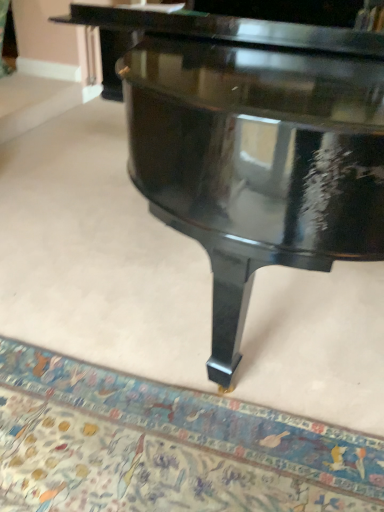
Question: In which direction should I rotate to look at carpet with intricate patterns at lower center?

Choices:
 (A) left
 (B) right

Answer: (A)

Question: Is glossy black piano at center further to camera compared to carpet with intricate patterns at lower center?

Choices:
 (A) no
 (B) yes

Answer: (A)

Question: Considering the relative sizes of glossy black piano at center and carpet with intricate patterns at lower center in the image provided, is glossy black piano at center bigger than carpet with intricate patterns at lower center?

Choices:
 (A) yes
 (B) no

Answer: (A)

Question: Can you confirm if glossy black piano at center is shorter than carpet with intricate patterns at lower center?

Choices:
 (A) yes
 (B) no

Answer: (B)

Question: From a real-world perspective, is glossy black piano at center on carpet with intricate patterns at lower center?

Choices:
 (A) yes
 (B) no

Answer: (A)

Question: From the image's perspective, is glossy black piano at center on carpet with intricate patterns at lower center?

Choices:
 (A) yes
 (B) no

Answer: (A)

Question: Is glossy black piano at center closer to camera compared to carpet with intricate patterns at lower center?

Choices:
 (A) no
 (B) yes

Answer: (B)

Question: From the image's perspective, is carpet with intricate patterns at lower center located beneath glossy black piano at center?

Choices:
 (A) yes
 (B) no

Answer: (A)

Question: Can you confirm if carpet with intricate patterns at lower center is shorter than glossy black piano at center?

Choices:
 (A) no
 (B) yes

Answer: (B)

Question: Is glossy black piano at center at the back of carpet with intricate patterns at lower center?

Choices:
 (A) yes
 (B) no

Answer: (B)

Question: Can you confirm if carpet with intricate patterns at lower center is taller than glossy black piano at center?

Choices:
 (A) yes
 (B) no

Answer: (B)

Question: Considering the relative sizes of carpet with intricate patterns at lower center and glossy black piano at center in the image provided, is carpet with intricate patterns at lower center bigger than glossy black piano at center?

Choices:
 (A) yes
 (B) no

Answer: (B)

Question: Is carpet with intricate patterns at lower center with glossy black piano at center?

Choices:
 (A) no
 (B) yes

Answer: (A)

Question: Which is correct: glossy black piano at center is inside carpet with intricate patterns at lower center, or outside of it?

Choices:
 (A) inside
 (B) outside

Answer: (B)